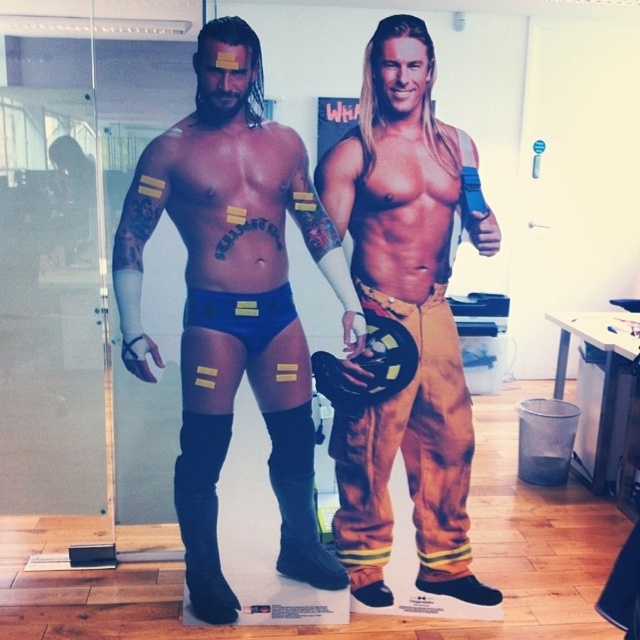
Looking at this image, does matte blue shorts at center come behind matte orange pants at center?

No, matte blue shorts at center is in front of matte orange pants at center.

Is point (131, 209) positioned behind point (396, 65)?

Yes, point (131, 209) is behind point (396, 65).

This screenshot has height=640, width=640. I want to click on matte blue shorts at center, so click(234, 305).

Does matte orange pants at center have a greater height compared to black suede boot at lower left?

Correct, matte orange pants at center is much taller as black suede boot at lower left.

Can you confirm if matte orange pants at center is bigger than black suede boot at lower left?

Yes, matte orange pants at center is bigger than black suede boot at lower left.

The width and height of the screenshot is (640, 640). What do you see at coordinates (404, 321) in the screenshot? I see `matte orange pants at center` at bounding box center [404, 321].

Image resolution: width=640 pixels, height=640 pixels. What are the coordinates of `matte orange pants at center` in the screenshot? It's located at (404, 321).

Is matte orange pants at center further to the viewer compared to black suede boot at lower center?

No, matte orange pants at center is closer to the viewer.

Is matte orange pants at center thinner than black suede boot at lower center?

No.

In order to click on matte orange pants at center in this screenshot , I will do `click(404, 321)`.